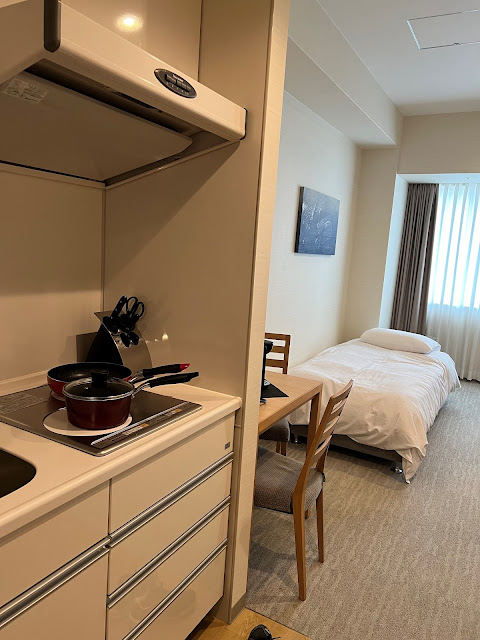
Where is `carpet`? carpet is located at coordinates (398, 516).